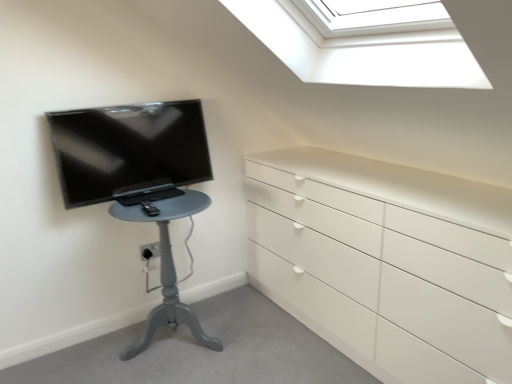
You are a GUI agent. You are given a task and a screenshot of the screen. Output one action in this format:
    pyautogui.click(x=<x>, y=<y>)
    Task: Click on the vacant space underneath matte gray table at left (from a real-world perspective)
    The image size is (512, 384).
    Given the screenshot: What is the action you would take?
    pyautogui.click(x=166, y=343)